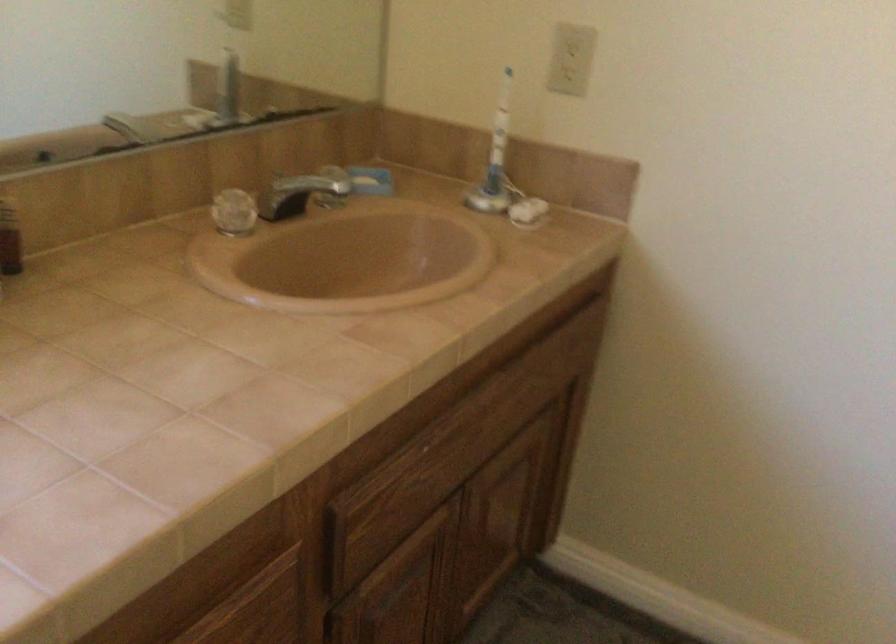
What do you see at coordinates (296, 194) in the screenshot? The image size is (896, 644). I see `the faucet handle` at bounding box center [296, 194].